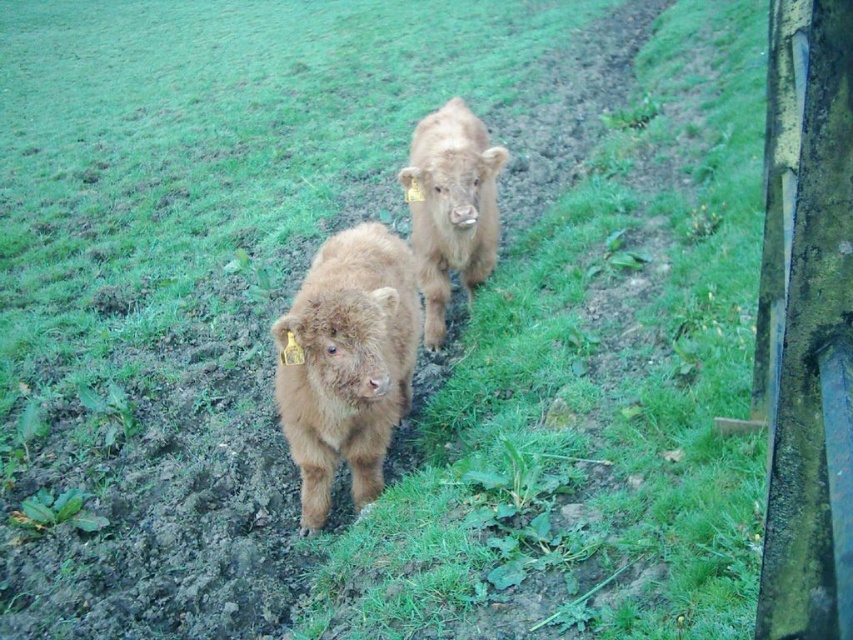
Question: Is fuzzy brown calf at center to the right of brown furry calf at center from the viewer's perspective?

Choices:
 (A) yes
 (B) no

Answer: (B)

Question: Does fuzzy brown calf at center appear under brown furry calf at center?

Choices:
 (A) yes
 (B) no

Answer: (A)

Question: Which object appears closest to the camera in this image?

Choices:
 (A) fuzzy brown calf at center
 (B) brown furry calf at center

Answer: (A)

Question: Which point is farther from the camera taking this photo?

Choices:
 (A) (465, 216)
 (B) (282, 381)

Answer: (A)

Question: Is fuzzy brown calf at center closer to the viewer compared to brown furry calf at center?

Choices:
 (A) yes
 (B) no

Answer: (A)

Question: Which object appears closest to the camera in this image?

Choices:
 (A) brown furry calf at center
 (B) fuzzy brown calf at center

Answer: (B)